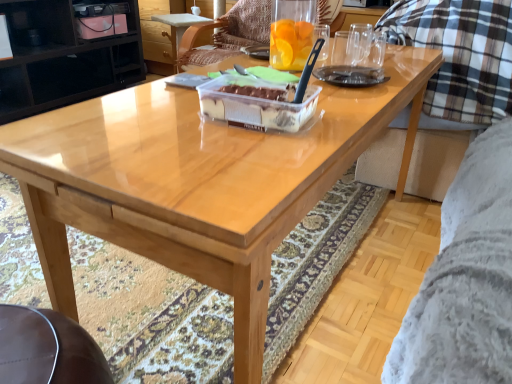
The width and height of the screenshot is (512, 384). Identify the location of vacant area that is situated to the right of translucent plastic cake at center. (346, 112).